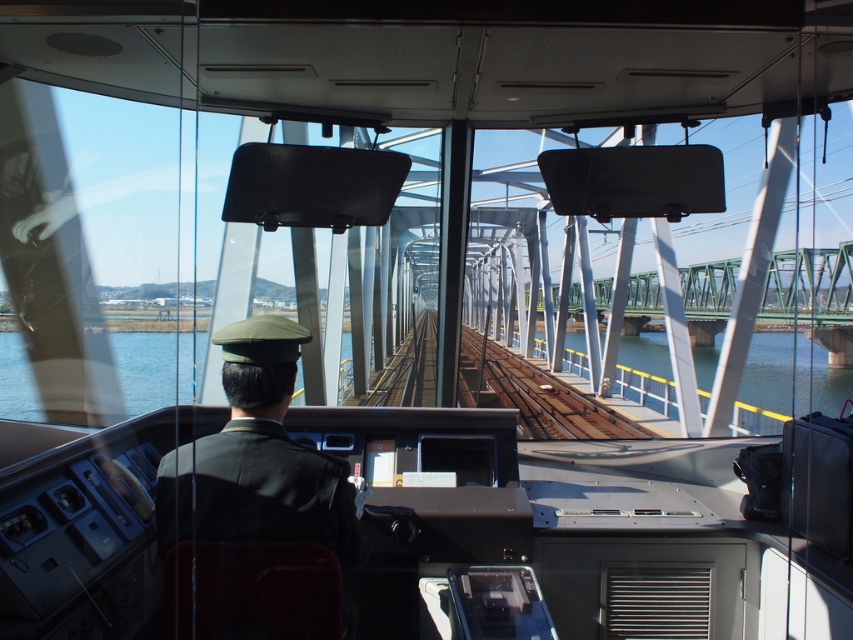
Question: Which object is positioned farthest from the brown wooden train track at center?

Choices:
 (A) dark green uniform at center
 (B) clear blue water at track right
 (C) blue water at center
 (D) green metallic bridge at center

Answer: (D)

Question: Is brown wooden train track at center below green metallic bridge at center?

Choices:
 (A) no
 (B) yes

Answer: (B)

Question: Based on their relative distances, which object is farther from the brown wooden train track at center?

Choices:
 (A) clear blue water at track right
 (B) dark green uniform at center

Answer: (A)

Question: Is blue water at center to the left of clear blue water at track right from the viewer's perspective?

Choices:
 (A) yes
 (B) no

Answer: (A)

Question: Which of the following is the closest to the observer?

Choices:
 (A) clear blue water at track right
 (B) blue water at center
 (C) dark green uniform at center

Answer: (C)

Question: Is dark green uniform at center to the right of blue water at center from the viewer's perspective?

Choices:
 (A) yes
 (B) no

Answer: (B)